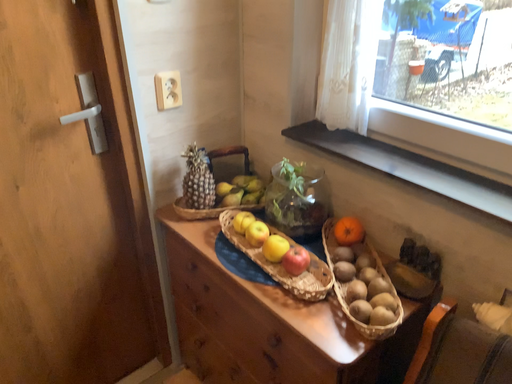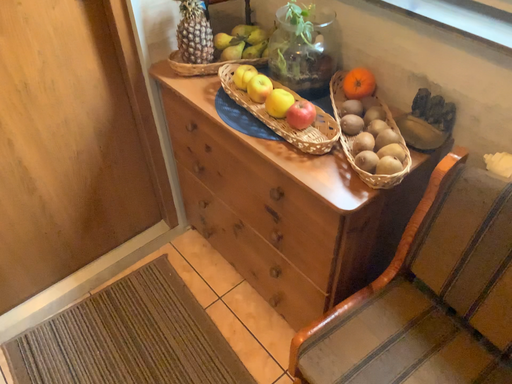
Question: Which way did the camera rotate in the video?

Choices:
 (A) rotated downward
 (B) rotated upward

Answer: (A)